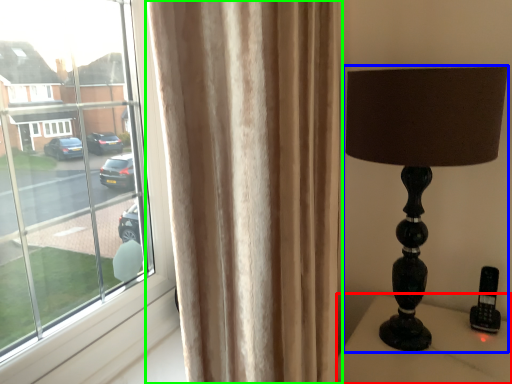
Question: Estimate the real-world distances between objects in this image. Which object is closer to furniture (highlighted by a red box), lamp (highlighted by a blue box) or curtain (highlighted by a green box)?

Choices:
 (A) lamp
 (B) curtain

Answer: (A)